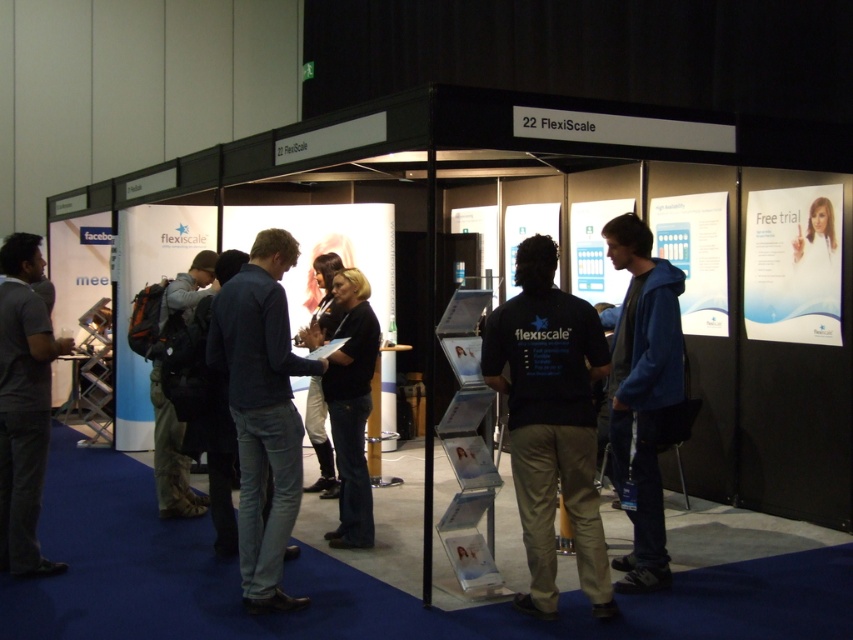
Who is more forward, [209,276] or [326,298]?

Point [209,276] is in front.

Is camouflage fabric backpack at left positioned behind black fabric at center?

That is False.

Is point (166, 460) in front of point (328, 474)?

Yes, it is in front of point (328, 474).

Find the location of a particular element. The width and height of the screenshot is (853, 640). camouflage fabric backpack at left is located at coordinates (170, 452).

Can you confirm if dark blue jeans at center is thinner than dark gray shirt at left?

No, dark blue jeans at center is not thinner than dark gray shirt at left.

Who is lower down, dark blue jeans at center or dark gray shirt at left?

Positioned lower is dark blue jeans at center.

Is point (276, 285) farther from viewer compared to point (3, 333)?

No, (276, 285) is closer to viewer.

Locate an element on the screen. The height and width of the screenshot is (640, 853). dark blue jeans at center is located at coordinates (262, 412).

Does point (277, 556) come behind point (357, 364)?

No, (277, 556) is closer to viewer.

Is dark blue jeans at center further to camera compared to black matte shirt at center?

No, dark blue jeans at center is in front of black matte shirt at center.

Based on the photo, who is more distant from viewer, (273, 339) or (343, 300)?

The point (343, 300) is more distant.

Locate an element on the screen. The image size is (853, 640). dark blue jeans at center is located at coordinates (262, 412).